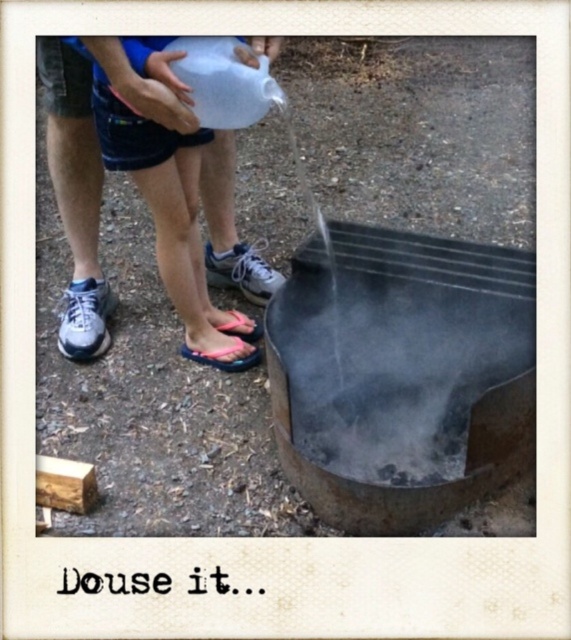
You are a firefighter assessing a fire scene. You see a rusty metal fire pit at lower center and blue denim shorts at left. Which object is larger in size?

The blue denim shorts at left are larger than the rusty metal fire pit at lower center according to the description.

You are a firefighter assessing the scene. You see the rusty metal fire pit at lower center and the blue denim shorts at left. Which object is positioned lower in the image?

The rusty metal fire pit at lower center is positioned below the blue denim shorts at left, so it is lower in the image.